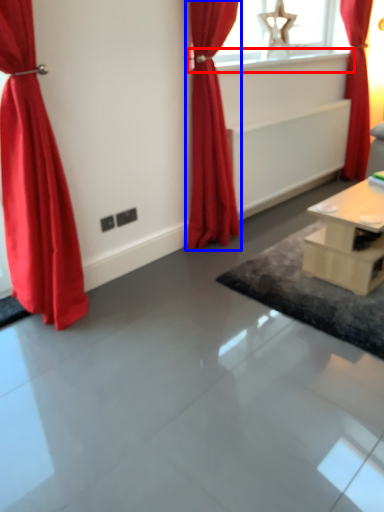
Question: Which point is closer to the camera, window sill (highlighted by a red box) or curtain (highlighted by a blue box)?

Choices:
 (A) window sill
 (B) curtain

Answer: (B)